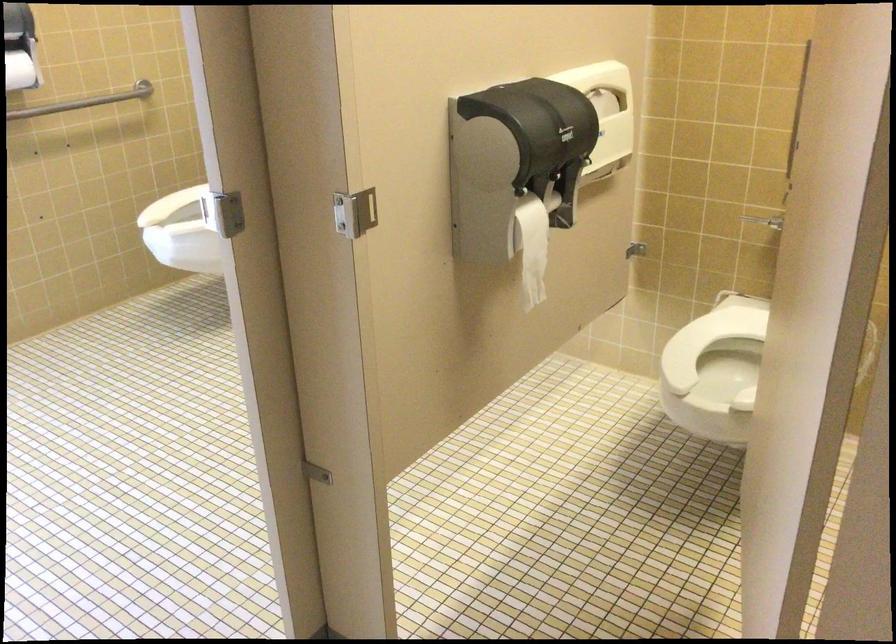
The width and height of the screenshot is (896, 644). Describe the element at coordinates (355, 212) in the screenshot. I see `a stall door latch` at that location.